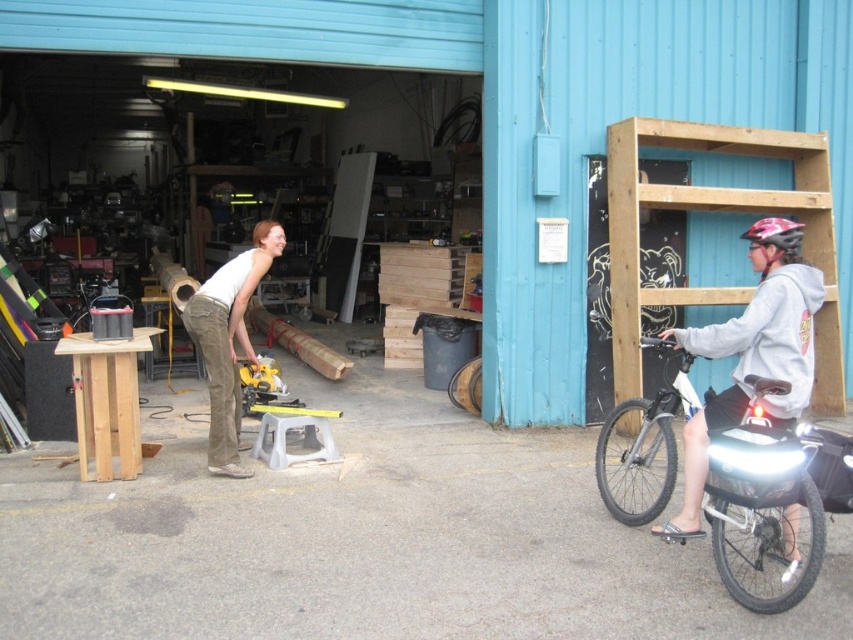
Question: Among these objects, which one is farthest from the camera?

Choices:
 (A) white matte shirt at center
 (B) pink matte bicycle helmet at upper right

Answer: (A)

Question: Can you confirm if shiny metallic bicycle at right is thinner than pink matte bicycle helmet at upper right?

Choices:
 (A) no
 (B) yes

Answer: (A)

Question: Considering the real-world distances, which object is farthest from the pink matte bicycle helmet at upper right?

Choices:
 (A) shiny metallic bicycle at right
 (B) white matte shirt at center

Answer: (B)

Question: From the image, what is the correct spatial relationship of white matte shirt at center in relation to pink matte bicycle helmet at upper right?

Choices:
 (A) above
 (B) below

Answer: (B)

Question: Which object is the closest to the shiny metallic bicycle at right?

Choices:
 (A) pink matte bicycle helmet at upper right
 (B) white matte shirt at center

Answer: (A)

Question: Is shiny metallic bicycle at right wider than pink matte bicycle helmet at upper right?

Choices:
 (A) yes
 (B) no

Answer: (A)